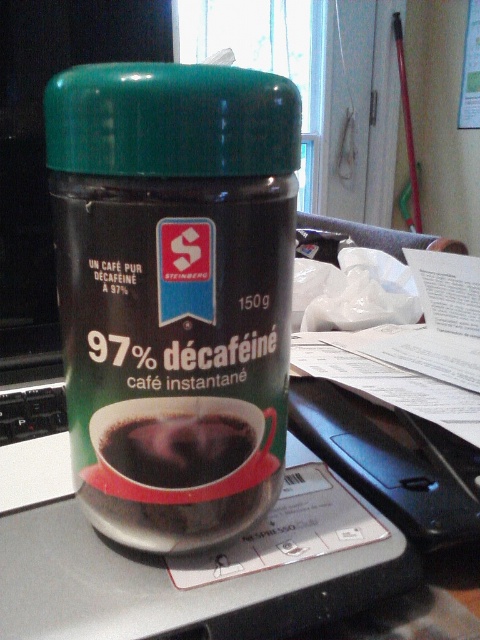
Is green matte jar at center below dark matte coffee cup at center?

Actually, green matte jar at center is above dark matte coffee cup at center.

In the scene shown: Which of these two, green matte jar at center or dark matte coffee cup at center, stands shorter?

With less height is dark matte coffee cup at center.

Is point (108, 387) positioned after point (180, 470)?

No, it is in front of (180, 470).

You are a GUI agent. You are given a task and a screenshot of the screen. Output one action in this format:
    pyautogui.click(x=<x>, y=<y>)
    Task: Click on the green matte jar at center
    This screenshot has height=640, width=480.
    Given the screenshot: What is the action you would take?
    pyautogui.click(x=173, y=292)

Does green glossy lid at center have a greater width compared to dark matte coffee cup at center?

Indeed, green glossy lid at center has a greater width compared to dark matte coffee cup at center.

In the scene shown: How far apart are green glossy lid at center and dark matte coffee cup at center?

They are 4.98 inches apart.

What are the coordinates of `green glossy lid at center` in the screenshot? It's located at (171, 120).

Is green matte jar at center above green glossy lid at center?

Incorrect, green matte jar at center is not positioned above green glossy lid at center.

Who is positioned more to the right, green matte jar at center or green glossy lid at center?

From the viewer's perspective, green glossy lid at center appears more on the right side.

This screenshot has height=640, width=480. In order to click on green matte jar at center in this screenshot , I will do `click(173, 292)`.